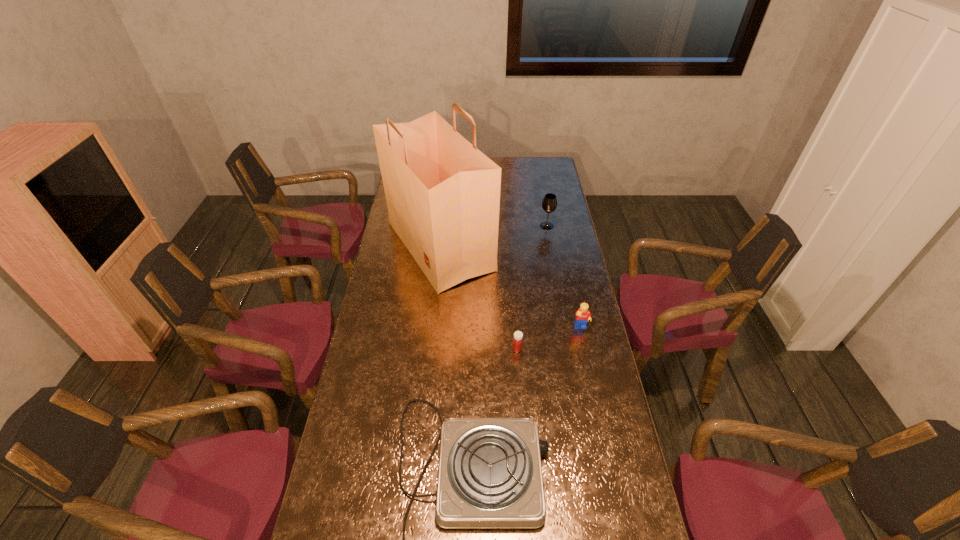
The height and width of the screenshot is (540, 960). In order to click on object that is at the left edge in this screenshot , I will do `click(443, 194)`.

Locate an element on the screen. wineglass at the right edge is located at coordinates (549, 204).

Identify the location of Lego that is at the right edge. The image size is (960, 540). [x=583, y=314].

At what (x,y) coordinates should I click in order to perform the action: click on free space at the left edge. Please return your answer as a coordinate pair (x, y). The height and width of the screenshot is (540, 960). Looking at the image, I should click on (376, 318).

The height and width of the screenshot is (540, 960). In order to click on vacant area at the right edge in this screenshot , I will do pos(581,357).

I want to click on vacant space at the far right corner of the desktop, so click(x=539, y=171).

Find the location of a particular element. free space between the medicine and the tallest object is located at coordinates [479, 298].

Where is `vacant area between the fourth shortest object and the fourth tallest object`? The height and width of the screenshot is (540, 960). vacant area between the fourth shortest object and the fourth tallest object is located at coordinates (532, 287).

Where is `empty space between the tallest object and the fourth farthest object`? This screenshot has width=960, height=540. empty space between the tallest object and the fourth farthest object is located at coordinates [x=479, y=298].

Where is `empty location between the Lego and the tallest object`? The width and height of the screenshot is (960, 540). empty location between the Lego and the tallest object is located at coordinates (511, 287).